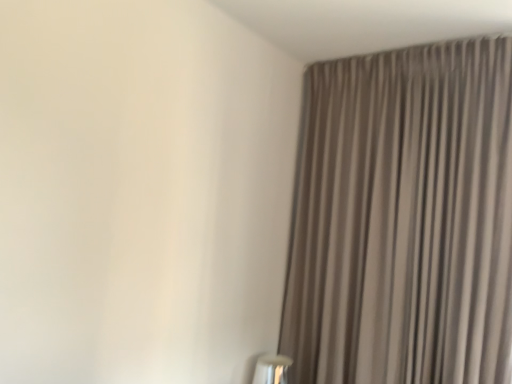
Question: Should I look upward or downward to see neutral striped curtain at right?

Choices:
 (A) up
 (B) down

Answer: (B)

Question: From a real-world perspective, is white glossy table lamp at lower right positioned over neutral striped curtain at right based on gravity?

Choices:
 (A) no
 (B) yes

Answer: (A)

Question: From the image's perspective, is white glossy table lamp at lower right on neutral striped curtain at right?

Choices:
 (A) no
 (B) yes

Answer: (A)

Question: Is white glossy table lamp at lower right closer to the viewer compared to neutral striped curtain at right?

Choices:
 (A) yes
 (B) no

Answer: (B)

Question: Does white glossy table lamp at lower right have a lesser width compared to neutral striped curtain at right?

Choices:
 (A) yes
 (B) no

Answer: (A)

Question: Would you say white glossy table lamp at lower right is outside neutral striped curtain at right?

Choices:
 (A) no
 (B) yes

Answer: (B)

Question: Is white glossy table lamp at lower right far from neutral striped curtain at right?

Choices:
 (A) yes
 (B) no

Answer: (B)

Question: Is neutral striped curtain at right to the left of white glossy table lamp at lower right from the viewer's perspective?

Choices:
 (A) yes
 (B) no

Answer: (B)

Question: Can you confirm if neutral striped curtain at right is wider than white glossy table lamp at lower right?

Choices:
 (A) yes
 (B) no

Answer: (A)

Question: Is neutral striped curtain at right further to camera compared to white glossy table lamp at lower right?

Choices:
 (A) no
 (B) yes

Answer: (A)

Question: From a real-world perspective, is neutral striped curtain at right beneath white glossy table lamp at lower right?

Choices:
 (A) yes
 (B) no

Answer: (B)

Question: From the image's perspective, is neutral striped curtain at right located above white glossy table lamp at lower right?

Choices:
 (A) yes
 (B) no

Answer: (A)

Question: Is neutral striped curtain at right turned away from white glossy table lamp at lower right?

Choices:
 (A) yes
 (B) no

Answer: (B)

Question: Looking at the image, does white glossy table lamp at lower right seem bigger or smaller compared to neutral striped curtain at right?

Choices:
 (A) big
 (B) small

Answer: (B)